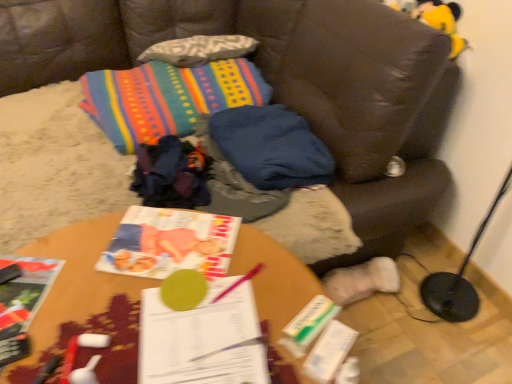
What are the coordinates of `vacant area on top of wooden table at center (from a real-world perspective)` in the screenshot? It's located at (150, 289).